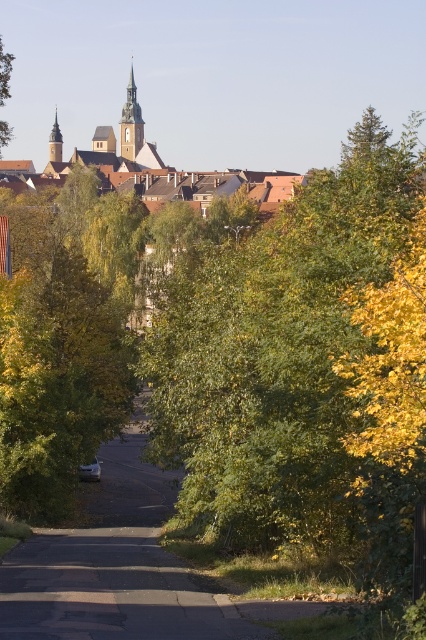
Question: Is white asphalt road at center further to the viewer compared to green leafy tree at upper left?

Choices:
 (A) yes
 (B) no

Answer: (B)

Question: Estimate the real-world distances between objects in this image. Which object is farther from the white asphalt road at center?

Choices:
 (A) brown tiled roofs at upper center
 (B) green leafy tree at upper left

Answer: (A)

Question: Is white asphalt road at center positioned before brown tiled roofs at upper center?

Choices:
 (A) yes
 (B) no

Answer: (A)

Question: Does white asphalt road at center appear on the right side of green leafy tree at upper left?

Choices:
 (A) no
 (B) yes

Answer: (B)

Question: Which point is closer to the camera?

Choices:
 (A) (120, 124)
 (B) (187, 632)
 (C) (0, 38)

Answer: (B)

Question: Which point is farther to the camera?

Choices:
 (A) green leafy tree at upper left
 (B) brown tiled roofs at upper center
 (C) white asphalt road at center

Answer: (B)